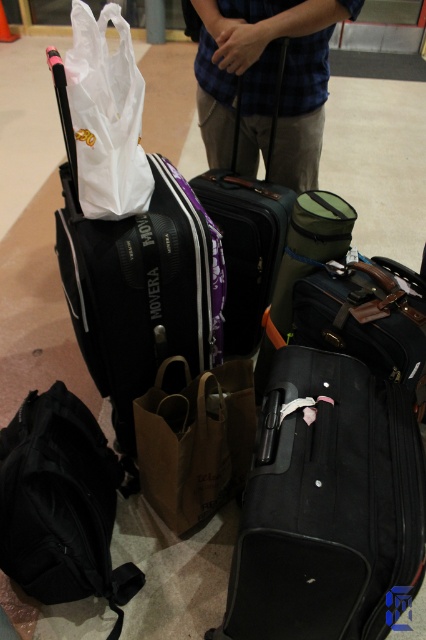
Question: Which of the following is the closest to the observer?

Choices:
 (A) white matte plastic bag at upper left
 (B) black fabric bag at lower left

Answer: (A)

Question: Is black fabric bag at lower left further to camera compared to blue plaid shirt at upper center?

Choices:
 (A) no
 (B) yes

Answer: (A)

Question: Which object is farther from the camera taking this photo?

Choices:
 (A) black matte suitcase at lower right
 (B) blue plaid shirt at upper center
 (C) black fabric bag at lower left
 (D) matte black suitcase at center

Answer: (D)

Question: Which point is farther from the camera taking this photo?

Choices:
 (A) (23, 468)
 (B) (244, 320)
 (C) (296, 12)
 (D) (420, 572)

Answer: (B)

Question: Can you confirm if black matte suitcase at lower right is bigger than blue plaid shirt at upper center?

Choices:
 (A) no
 (B) yes

Answer: (A)

Question: Can you confirm if black matte suitcase at lower right is positioned to the right of matte black suitcase at center?

Choices:
 (A) yes
 (B) no

Answer: (A)